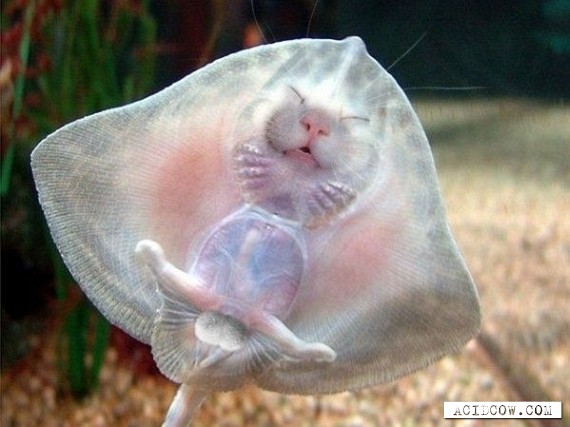
Where is `pink chest`? This screenshot has width=570, height=427. pink chest is located at coordinates (363, 270).